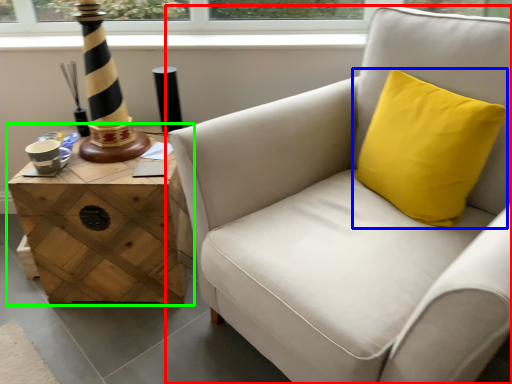
Question: Considering the real-world distances, which object is farthest from chair (highlighted by a red box)? pillow (highlighted by a blue box) or table (highlighted by a green box)?

Choices:
 (A) pillow
 (B) table

Answer: (B)